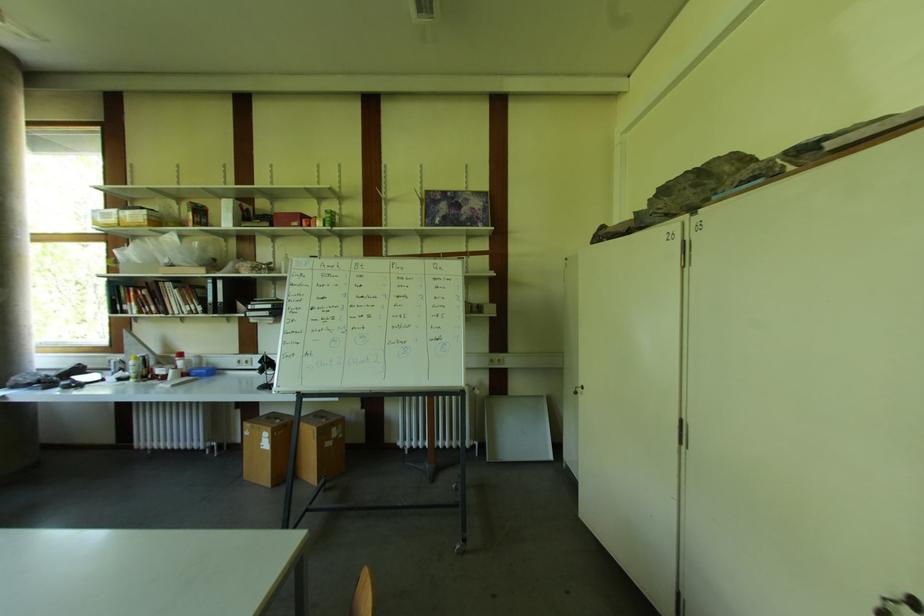
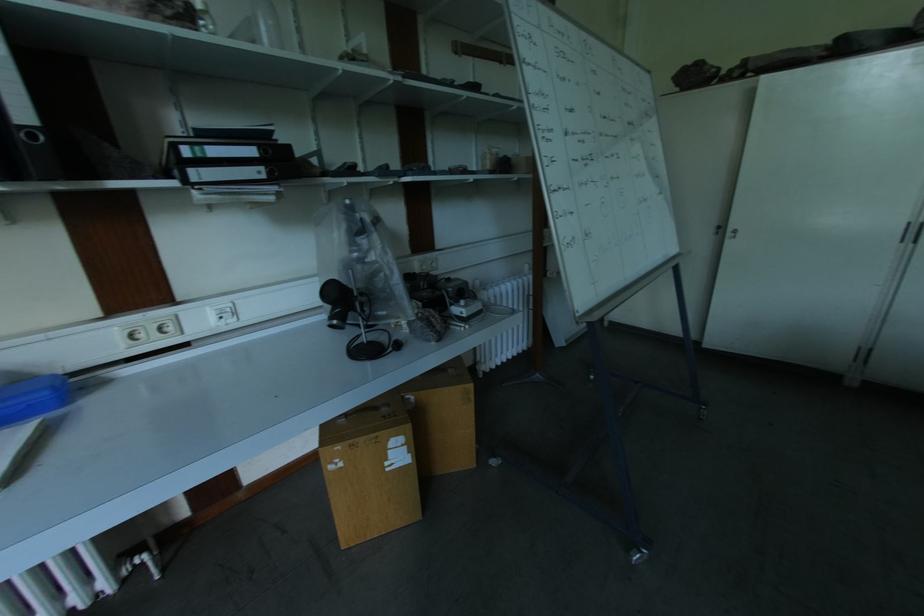
Where in the second image is the point corresponding to point (578, 395) from the first image?

(737, 238)